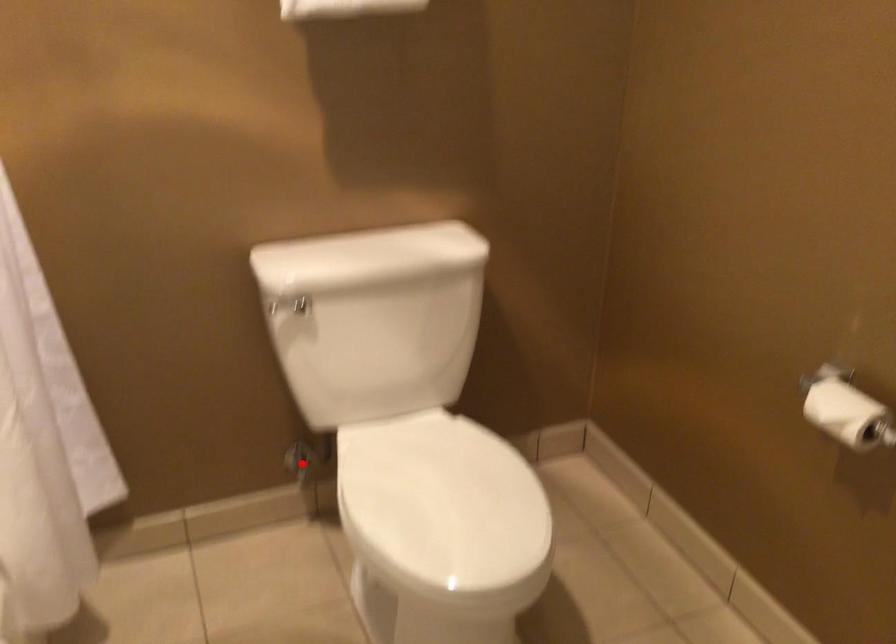
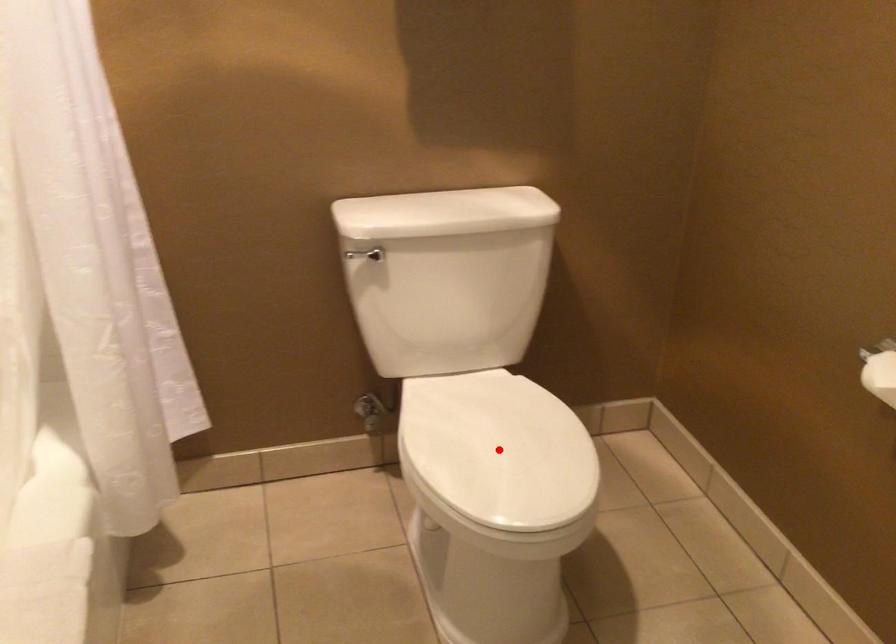
I am providing you with two images of the same scene from different viewpoints. A red point is marked on the first image and another point is marked on the second image. Is the marked point in image1 the same physical position as the marked point in image2?

No